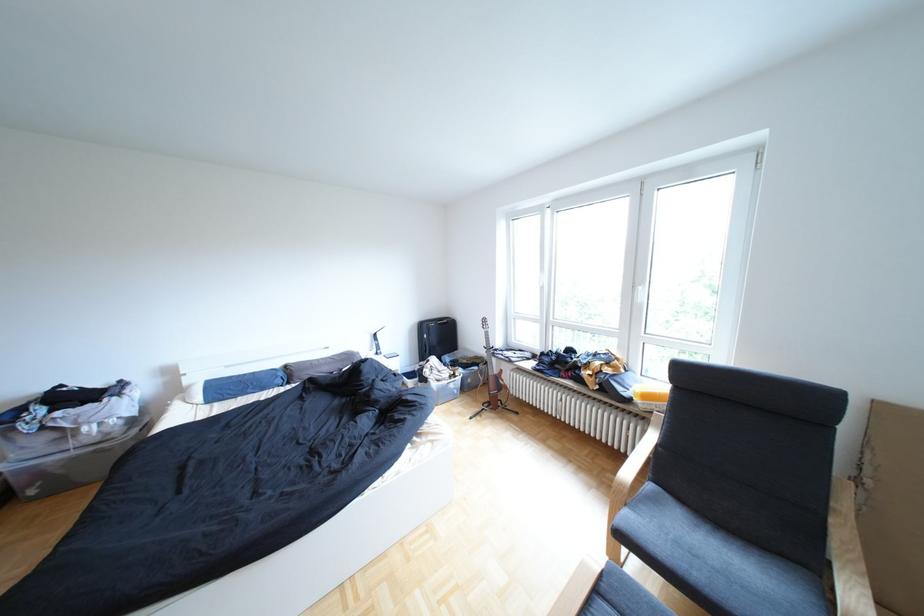
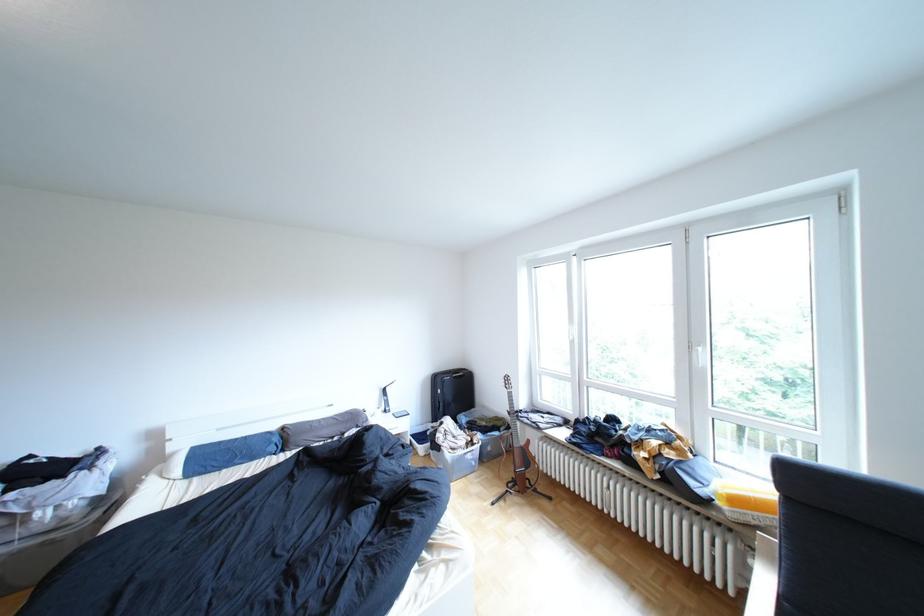
Where in the second image is the point corresponding to (214,399) from the first image?

(193, 472)